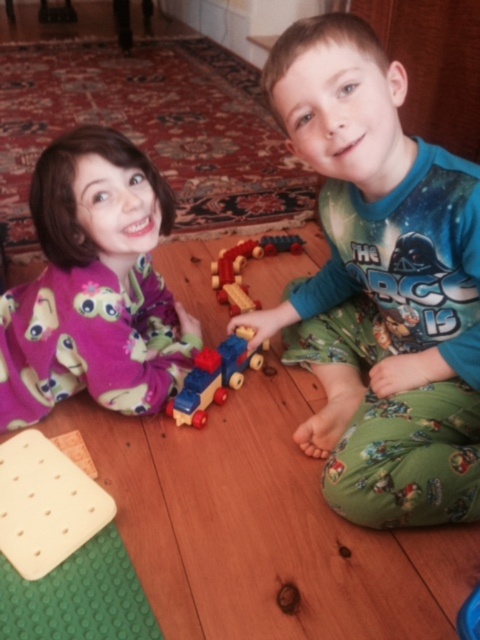
Question: Which object appears closest to the camera in this image?

Choices:
 (A) green cotton pajamas at center
 (B) wooden train at center

Answer: (A)

Question: Does green cotton pajamas at center appear on the left side of wooden train at center?

Choices:
 (A) yes
 (B) no

Answer: (B)

Question: Which point is closer to the camera?

Choices:
 (A) matte purple pajamas at left
 (B) wooden train at center
 (C) green cotton pajamas at center

Answer: (C)

Question: Is green cotton pajamas at center above wooden train at center?

Choices:
 (A) no
 (B) yes

Answer: (B)

Question: Can you confirm if matte purple pajamas at left is smaller than wooden train at center?

Choices:
 (A) no
 (B) yes

Answer: (A)

Question: Which object is positioned closest to the matte purple pajamas at left?

Choices:
 (A) wooden train at center
 (B) green cotton pajamas at center

Answer: (A)